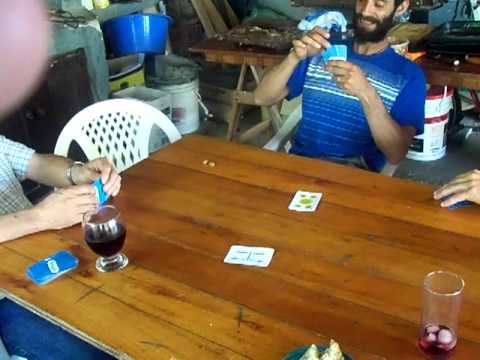
Identify the location of bucket. (185, 108), (164, 108), (436, 142).